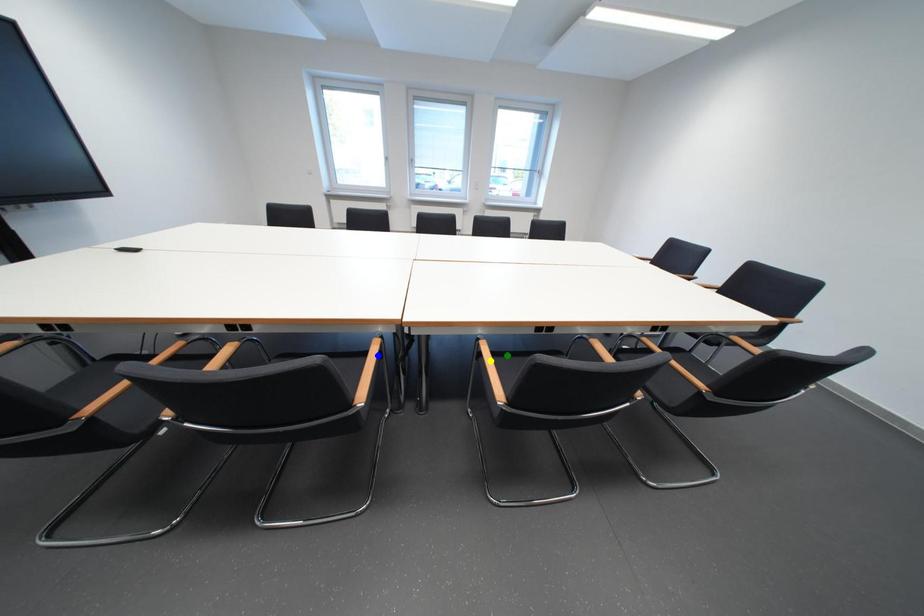
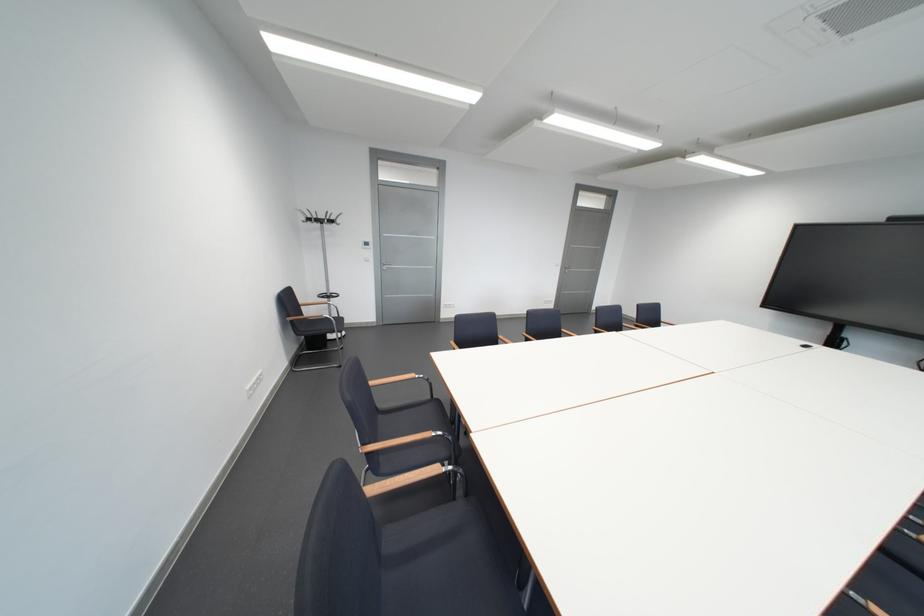
I am providing you with two images of the same scene from different viewpoints. Three points are marked in image1. Which point corresponds to a part or object that is occluded in image2?In image1, three points are marked. Which of them correspond to a part or object that is occluded in image2?Among the three points shown in image1, which one corresponds to a part or object that is no longer visible due to occlusion in image2?

yellow point, green point, blue point